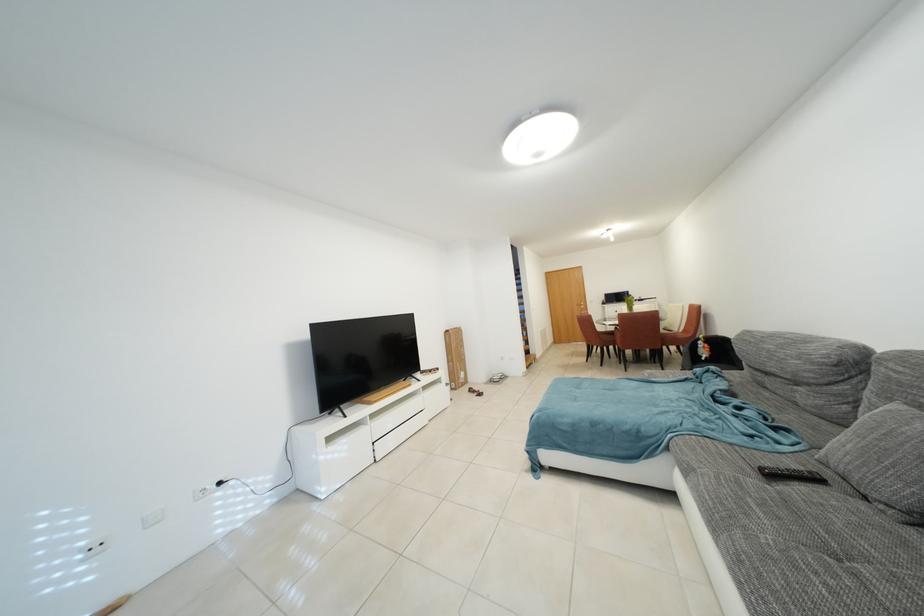
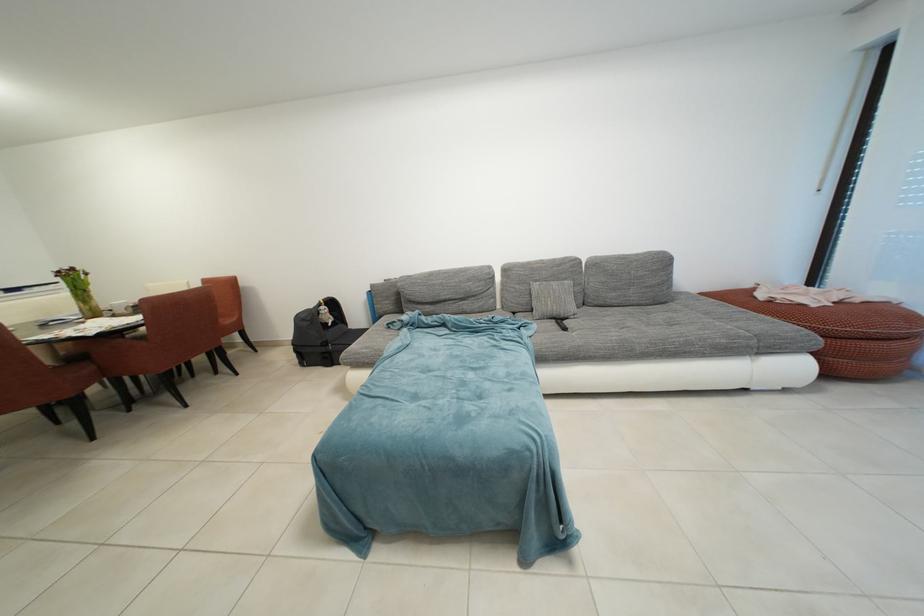
Locate, in the second image, the point that corresponds to pixel 817 389 in the first image.

(482, 301)